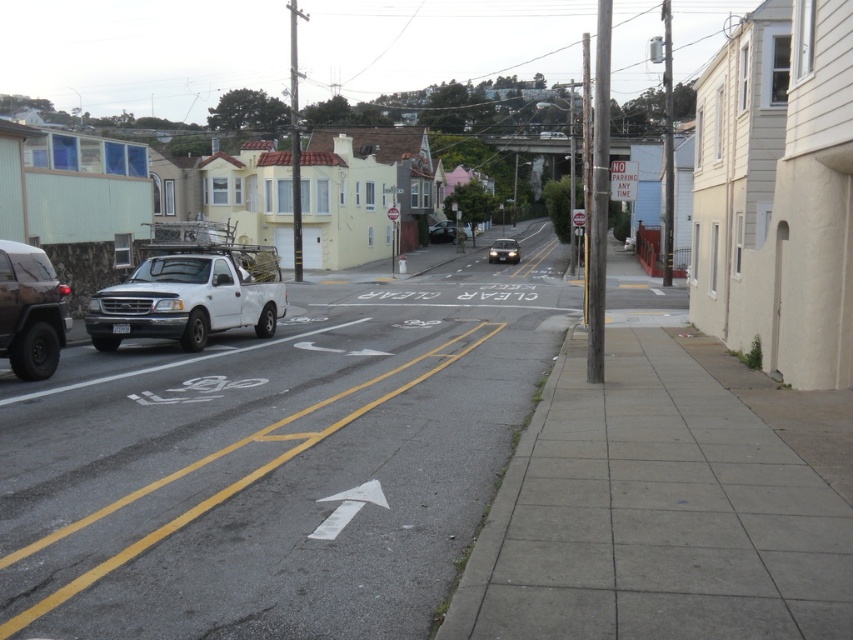
Measure the distance from white matte truck at left to shiny black sedan at center.

white matte truck at left is 37.33 meters from shiny black sedan at center.

Is white matte truck at left positioned at the back of shiny black sedan at center?

No.

Which is behind, point (225, 276) or point (428, 227)?

The point (428, 227) is behind.

Locate an element on the screen. white matte truck at left is located at coordinates (190, 298).

Which is behind, point (0, 266) or point (440, 234)?

The point (440, 234) is more distant.

Is matte black suv at left positioned at the back of shiny black sedan at center?

No, it is in front of shiny black sedan at center.

You are a GUI agent. You are given a task and a screenshot of the screen. Output one action in this format:
    pyautogui.click(x=<x>, y=<y>)
    Task: Click on the matte black suv at left
    The image size is (853, 640).
    Given the screenshot: What is the action you would take?
    pyautogui.click(x=30, y=310)

Which is below, gray asphalt at center or shiny silver sedan at center?

Positioned lower is gray asphalt at center.

Who is more distant from viewer, (384, 529) or (502, 243)?

Positioned behind is point (502, 243).

Locate an element on the screen. This screenshot has width=853, height=640. gray asphalt at center is located at coordinates (276, 467).